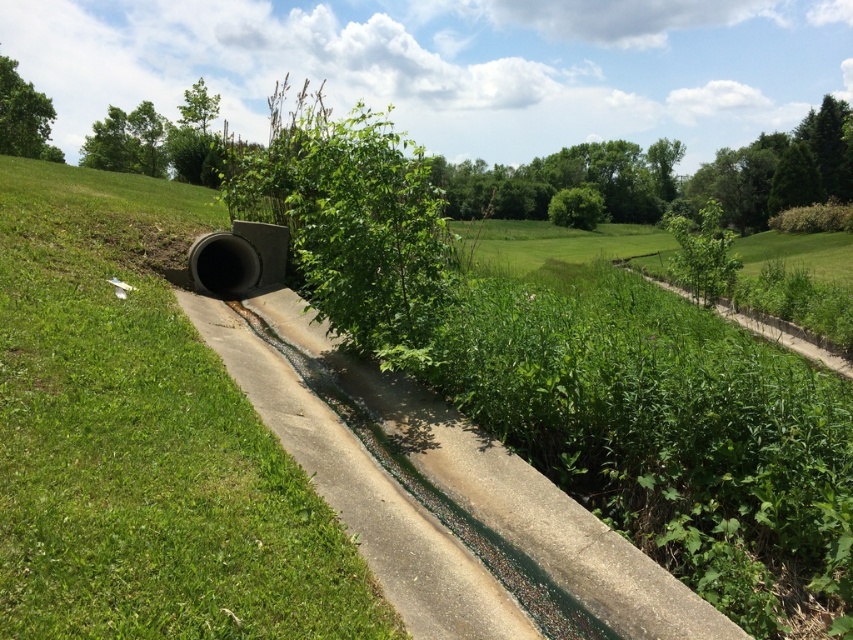
Can you confirm if green grass at center is positioned below green leafy plant at upper right?

Yes.

Does green grass at center have a lesser width compared to green leafy plant at upper right?

Yes.

Locate an element on the screen. green grass at center is located at coordinates (142, 440).

Where is `green grass at center`? The height and width of the screenshot is (640, 853). green grass at center is located at coordinates (142, 440).

Where is `green grass at center`? The width and height of the screenshot is (853, 640). green grass at center is located at coordinates (142, 440).

Is green leafy plant at center thinner than green leafy plant at upper right?

Yes, green leafy plant at center is thinner than green leafy plant at upper right.

Can you confirm if green leafy plant at center is wider than green leafy plant at upper right?

No.

What do you see at coordinates (349, 225) in the screenshot? The image size is (853, 640). I see `green leafy plant at center` at bounding box center [349, 225].

What are the coordinates of `green leafy plant at center` in the screenshot? It's located at (349, 225).